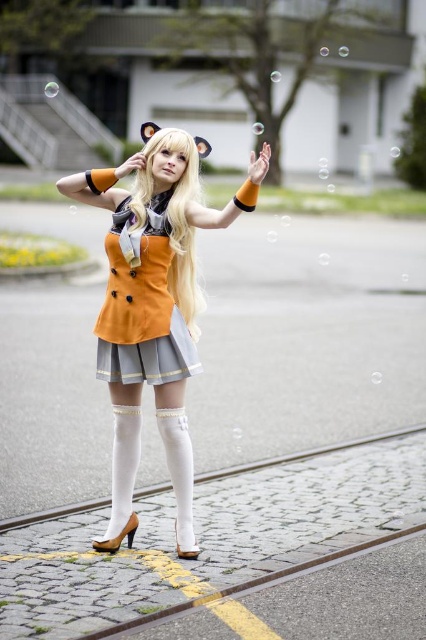
You are a photographer trying to capture the cosplay outfit. You notice the orange fabric dress at center and the blonde silky hair at center. Which object is located more to the left side?

The orange fabric dress at center is positioned on the left side of blonde silky hair at center, so it is more to the left.

In the scene shown: You are a photographer trying to capture a closeup shot of the orange fabric dress at center and orange satin dress at center. Since you want to focus on the details of the fabric, which dress should you zoom in on more to ensure the texture is visible?

The orange fabric dress at center has a larger size compared to orange satin dress at center, so you should zoom in more on the orange fabric dress at center to ensure the texture is visible.

Looking at this image, you are a photographer trying to capture a closeup shot of the orange satin dress at center and the blonde silky hair at center. Your camera has a maximum focus range of 20 centimeters. Can you focus on both subjects simultaneously?

The distance between the orange satin dress at center and the blonde silky hair at center is 23.28 centimeters. Since this exceeds the camera maximum focus range of 20 centimeters, you cannot focus on both subjects simultaneously.